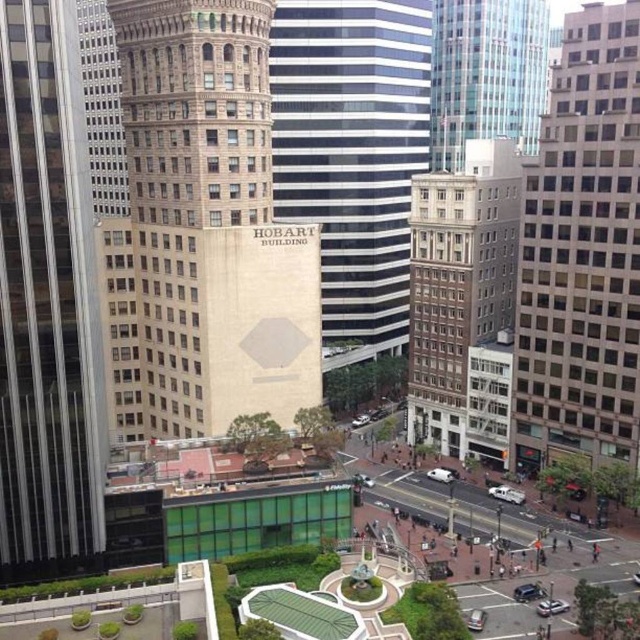
Question: Which object appears farthest from the camera in this image?

Choices:
 (A) black and white striped building at center
 (B) beige stone tower at center

Answer: (A)

Question: Which object appears closest to the camera in this image?

Choices:
 (A) glassy steel skyscraper at center
 (B) glassy reflective skyscraper at upper center
 (C) beige stone tower at center

Answer: (A)

Question: In this image, where is beige glass building at right located relative to black and white striped building at center?

Choices:
 (A) below
 (B) above

Answer: (A)

Question: From the image, what is the correct spatial relationship of black and white striped building at center in relation to brown brick building at center?

Choices:
 (A) below
 (B) above

Answer: (B)

Question: Which point is farther to the camera?

Choices:
 (A) (412, 260)
 (B) (109, 387)
 (C) (49, 442)

Answer: (A)

Question: Does beige stone tower at center have a greater width compared to glassy steel skyscraper at center?

Choices:
 (A) yes
 (B) no

Answer: (A)